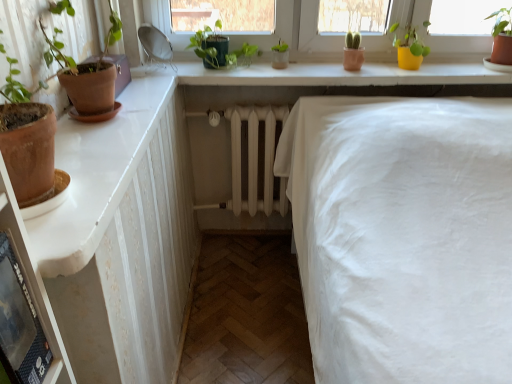
Question: From a real-world perspective, does black plastic shelf at lower left sit lower than yellow matte pot at upper right, positioned as the 2th houseplant in left-to-right order?

Choices:
 (A) yes
 (B) no

Answer: (A)

Question: Can you confirm if black plastic shelf at lower left is positioned to the right of yellow matte pot at upper right, placed as the first houseplant when sorted from right to left?

Choices:
 (A) yes
 (B) no

Answer: (B)

Question: Can you confirm if black plastic shelf at lower left is bigger than yellow matte pot at upper right, placed as the first houseplant when sorted from right to left?

Choices:
 (A) yes
 (B) no

Answer: (B)

Question: Can you confirm if black plastic shelf at lower left is wider than yellow matte pot at upper right, positioned as the 2th houseplant in left-to-right order?

Choices:
 (A) no
 (B) yes

Answer: (A)

Question: Does black plastic shelf at lower left come behind yellow matte pot at upper right, placed as the first houseplant when sorted from right to left?

Choices:
 (A) no
 (B) yes

Answer: (A)

Question: Does black plastic shelf at lower left have a lesser width compared to yellow matte pot at upper right, placed as the first houseplant when sorted from right to left?

Choices:
 (A) no
 (B) yes

Answer: (B)

Question: From a real-world perspective, is green matte plant at upper center, acting as the 1th houseplant starting from the left, located beneath terracotta clay pot at left?

Choices:
 (A) no
 (B) yes

Answer: (A)

Question: From the image's perspective, does green matte plant at upper center, acting as the 1th houseplant starting from the left, appear higher than terracotta clay pot at left?

Choices:
 (A) yes
 (B) no

Answer: (A)

Question: Is green matte plant at upper center, acting as the 1th houseplant starting from the left, wider than terracotta clay pot at left?

Choices:
 (A) no
 (B) yes

Answer: (B)

Question: Considering the relative sizes of green matte plant at upper center, acting as the 1th houseplant starting from the left, and terracotta clay pot at left in the image provided, is green matte plant at upper center, acting as the 1th houseplant starting from the left, smaller than terracotta clay pot at left?

Choices:
 (A) yes
 (B) no

Answer: (B)

Question: Would you say green matte plant at upper center, acting as the 1th houseplant starting from the left, contains terracotta clay pot at left?

Choices:
 (A) yes
 (B) no

Answer: (B)

Question: From the image's perspective, does black plastic shelf at lower left appear higher than terracotta clay pot at left?

Choices:
 (A) yes
 (B) no

Answer: (B)